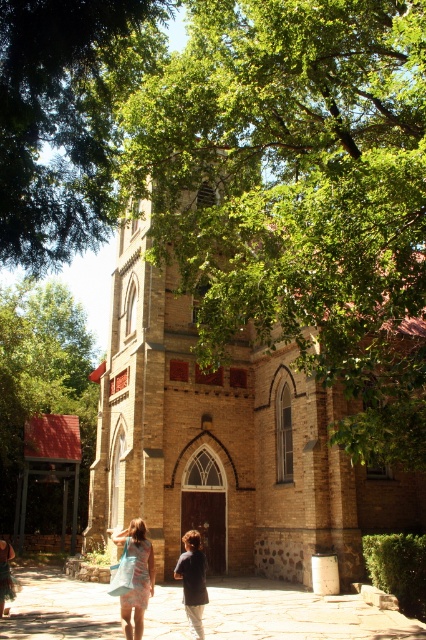
Question: Where is brown brick church at center located in relation to green leafy tree at upper left in the image?

Choices:
 (A) right
 (B) left

Answer: (A)

Question: Which point appears closest to the camera in this image?

Choices:
 (A) (141, 522)
 (B) (186, 584)
 (C) (2, 106)
 (D) (11, 301)

Answer: (C)

Question: Does green leafy tree at upper center appear on the right side of light blue fabric dress at lower center?

Choices:
 (A) no
 (B) yes

Answer: (A)

Question: Which object appears closest to the camera in this image?

Choices:
 (A) brown brick church at center
 (B) light blue fabric dress at lower center
 (C) paved stone pathway at center
 (D) green leafy tree at upper left

Answer: (B)

Question: Observing the image, what is the correct spatial positioning of brown brick church at center in reference to green leafy tree at upper center?

Choices:
 (A) left
 (B) right

Answer: (B)

Question: Which object is closer to the camera taking this photo?

Choices:
 (A) dark blue shirt at center
 (B) green leafy tree at upper center

Answer: (B)